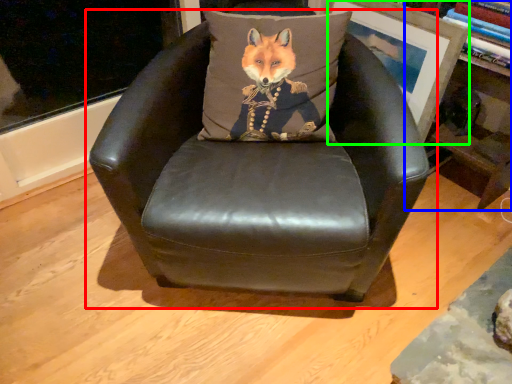
Question: Which object is positioned closest to chair (highlighted by a red box)? Select from bookshelf (highlighted by a blue box) and picture frame (highlighted by a green box).

Choices:
 (A) bookshelf
 (B) picture frame

Answer: (B)